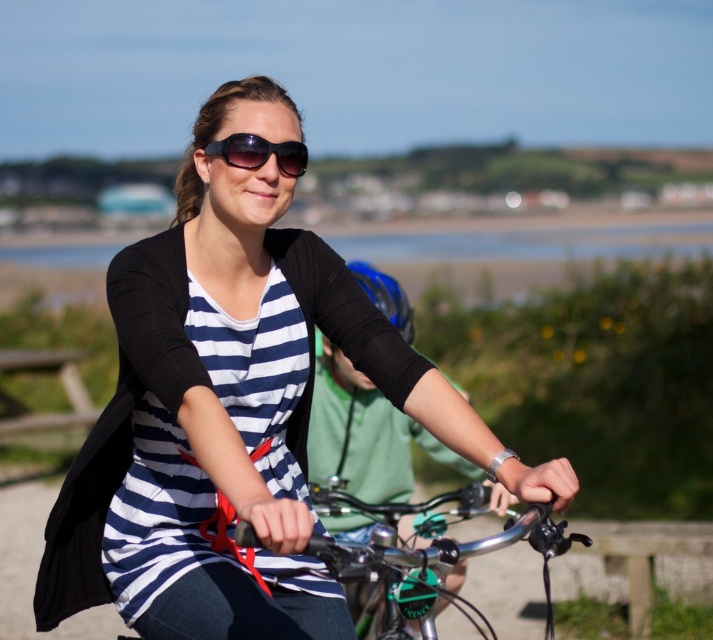
Who is positioned more to the left, metallic silver bicycle handlebars at center or sunglasses at center?

From the viewer's perspective, sunglasses at center appears more on the left side.

Between point (389, 577) and point (304, 166), which one is positioned behind?

The point (304, 166) is behind.

From the picture: Who is more distant from viewer, (x=421, y=616) or (x=240, y=134)?

The point (x=240, y=134) is behind.

Where is `metallic silver bicycle handlebars at center`? The height and width of the screenshot is (640, 713). metallic silver bicycle handlebars at center is located at coordinates (x=431, y=554).

Between point (322, 316) and point (230, 138), which one is positioned behind?

Positioned behind is point (322, 316).

Is point (255, 113) closer to camera compared to point (297, 157)?

Yes.

This screenshot has height=640, width=713. In order to click on navy striped shirt at center in this screenshot , I will do `click(232, 406)`.

Consider the image. Which is more to the right, navy striped shirt at center or metallic silver bicycle handlebars at center?

Positioned to the right is metallic silver bicycle handlebars at center.

Does navy striped shirt at center have a larger size compared to metallic silver bicycle handlebars at center?

Indeed, navy striped shirt at center has a larger size compared to metallic silver bicycle handlebars at center.

Between point (299, 605) and point (441, 548), which one is positioned in front?

Point (441, 548)

Where is `navy striped shirt at center`? The height and width of the screenshot is (640, 713). navy striped shirt at center is located at coordinates (232, 406).